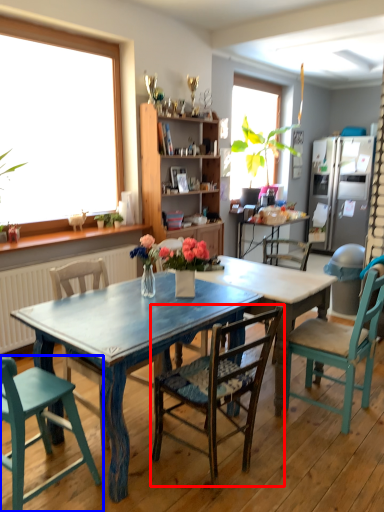
Question: Which point is closer to the camera, chair (highlighted by a red box) or chair (highlighted by a blue box)?

Choices:
 (A) chair
 (B) chair

Answer: (B)